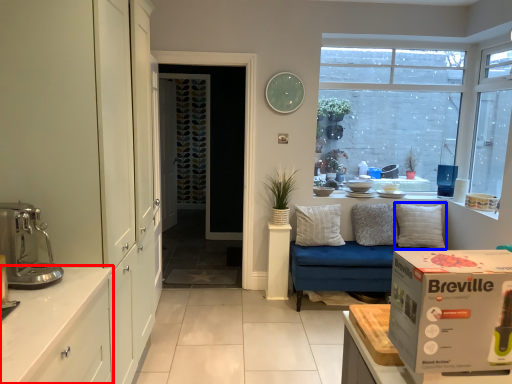
Question: Which of the following is the farthest to the observer, cabinetry (highlighted by a red box) or pillow (highlighted by a blue box)?

Choices:
 (A) cabinetry
 (B) pillow

Answer: (B)